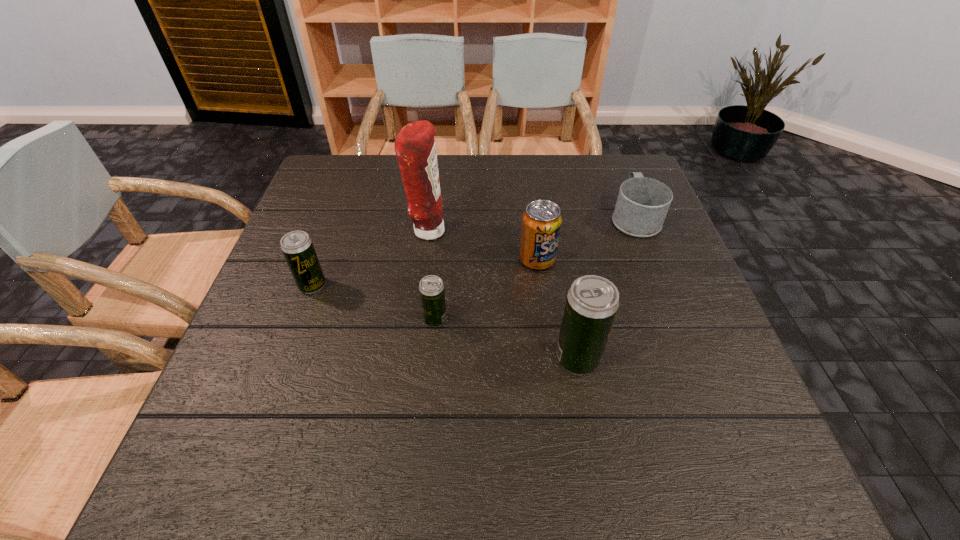
The image size is (960, 540). Find the location of `the third nearest object`. the third nearest object is located at coordinates (297, 247).

Locate an element on the screen. This screenshot has height=540, width=960. the second tallest beer can is located at coordinates (297, 247).

Where is `the shortest beer can`? The width and height of the screenshot is (960, 540). the shortest beer can is located at coordinates (431, 288).

Identify the location of the second nearest beer can. (431, 288).

The width and height of the screenshot is (960, 540). I want to click on the fifth shortest object, so click(592, 302).

I want to click on the nearest object, so click(x=592, y=302).

Locate an element on the screen. The image size is (960, 540). the rightmost object is located at coordinates (642, 204).

Locate an element on the screen. The image size is (960, 540). soda can is located at coordinates (541, 224).

In order to click on the tallest object in this screenshot , I will do `click(415, 148)`.

The image size is (960, 540). I want to click on free spot located on the left of the farthest beer can, so click(x=273, y=285).